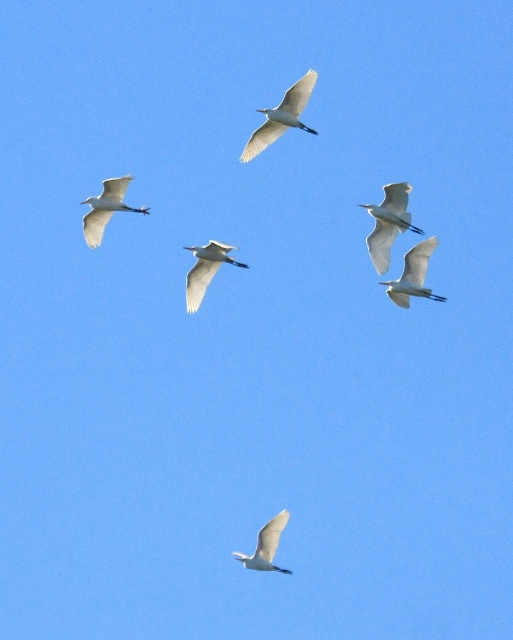
You are a birdwatcher observing the six white birds in flight. You notice two specific birds labeled as the white feathered bird at center and the white feathered bird at upper left. From your perspective, which bird appears closer to you?

The white feathered bird at center appears closer because it is positioned in front of the white feathered bird at upper left, indicating a closer proximity to the observer.

You are a photographer standing on a cliff edge, and you want to capture a white feathered bird at center flying in the clear blue sky. The bird is 284.46 feet away from you. Your camera has a zoom lens that can magnify objects up to 200 feet away. Will the bird appear blurry in your photo due to being too far?

The white feathered bird at center is 284.46 feet away from the camera, which exceeds the camera lens magnification limit of 200 feet. Therefore, the bird will appear blurry in the photo because it is beyond the camera lens range.

You are a birdwatcher trying to observe the white feathered bird at upper right. You have a telescope with a maximum range of 100 meters. Can you clearly see the bird with your telescope?

The white feathered bird at upper right is 86.83 meters away from the camera. Since your telescope can reach up to 100 meters, you can clearly see the bird with your telescope.